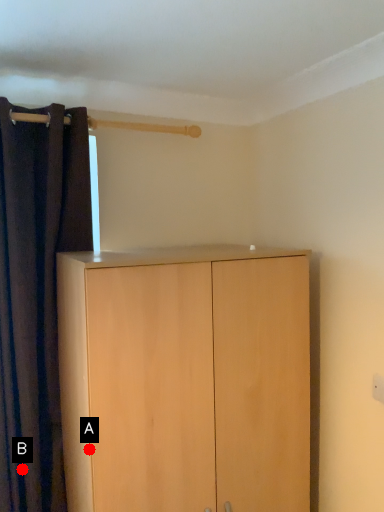
Question: Two points are circled on the image, labeled by A and B beside each circle. Which point is farther to the camera?

Choices:
 (A) A is further
 (B) B is further

Answer: (B)